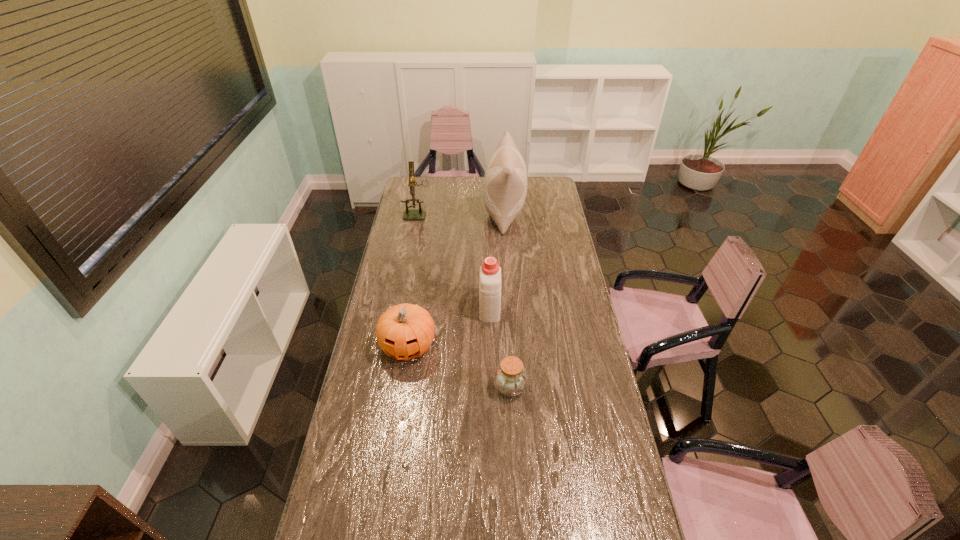
Identify the location of vacant space at the left edge. The height and width of the screenshot is (540, 960). (375, 383).

In the image, there is a desktop. At what (x,y) coordinates should I click in order to perform the action: click on free region at the right edge. Please return your answer as a coordinate pair (x, y). This screenshot has height=540, width=960. Looking at the image, I should click on (548, 279).

The image size is (960, 540). What are the coordinates of `free space at the far right corner of the desktop` in the screenshot? It's located at (536, 177).

Find the location of a particular element. The width and height of the screenshot is (960, 540). empty space that is in between the microscope and the tallest object is located at coordinates (461, 213).

The image size is (960, 540). In order to click on empty space that is in between the fourth tallest object and the microscope in this screenshot , I will do `click(413, 280)`.

Locate an element on the screen. The width and height of the screenshot is (960, 540). vacant point located between the microscope and the third farthest object is located at coordinates (453, 260).

This screenshot has width=960, height=540. I want to click on unoccupied position between the microscope and the detergent, so click(453, 260).

Identify the location of free point between the tallest object and the shortest object. Image resolution: width=960 pixels, height=540 pixels. (507, 300).

The height and width of the screenshot is (540, 960). In order to click on free spot between the microscope and the nearest object in this screenshot , I will do `click(464, 300)`.

Identify the location of free space between the microscope and the shortest object. The image size is (960, 540). (464, 300).